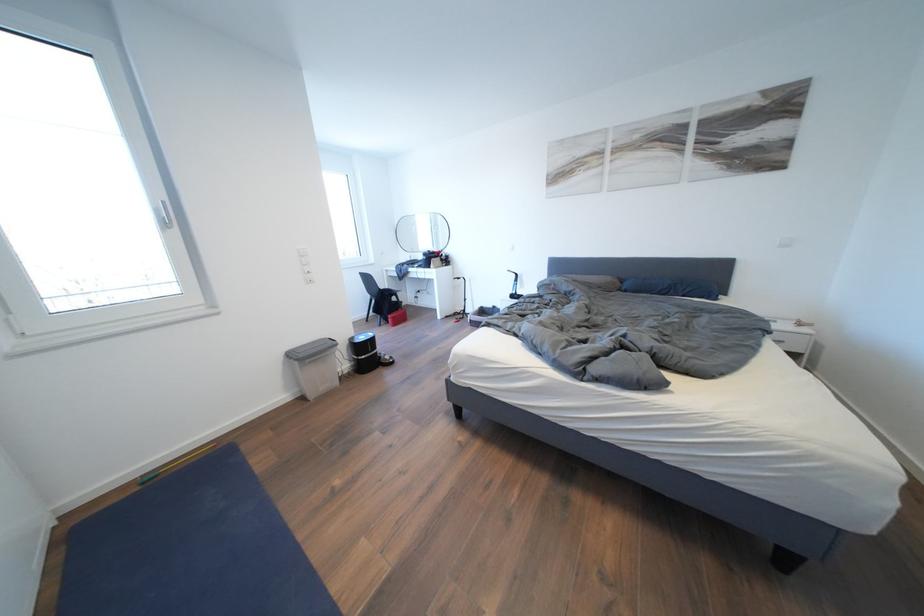
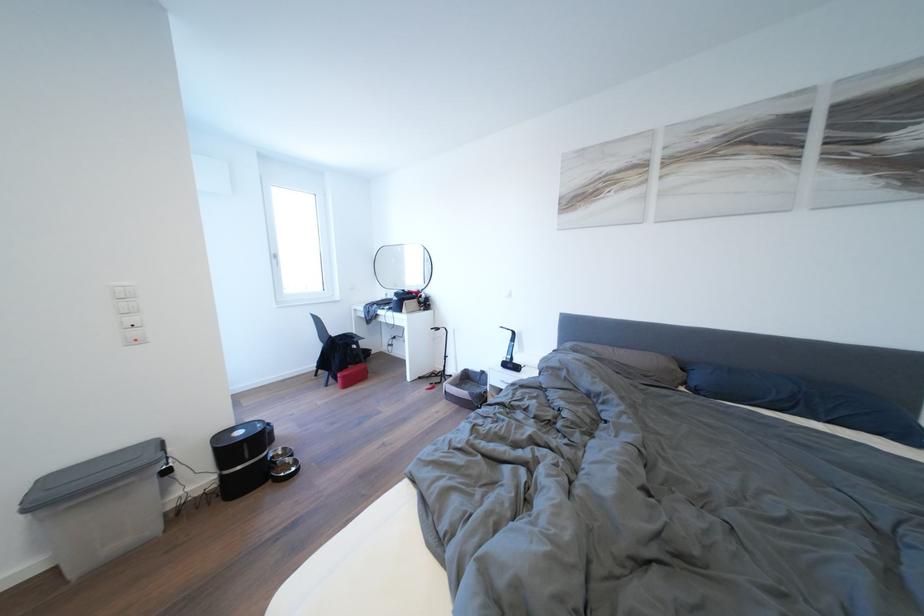
The point at (395, 362) is marked in the first image. Where is the corresponding point in the second image?

(296, 466)